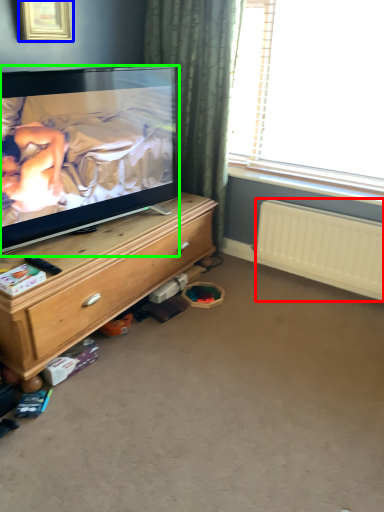
Question: Based on their relative distances, which object is nearer to radiator (highlighted by a red box)? Choose from picture frame (highlighted by a blue box) and television (highlighted by a green box).

Choices:
 (A) picture frame
 (B) television

Answer: (B)